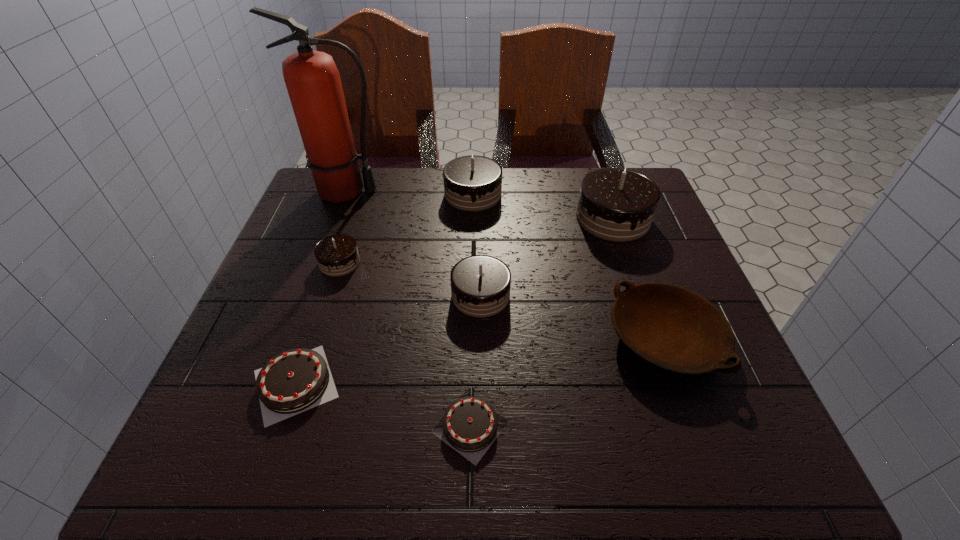
Find the location of a particular element. The height and width of the screenshot is (540, 960). vacant area situated 0.380m on the left of the brown plate is located at coordinates (406, 339).

I want to click on free space located 0.060m on the front of the left brown chocolate cake, so click(268, 465).

Find the location of a particular element. free region located on the back of the smaller brown chocolate cake is located at coordinates (473, 260).

I want to click on fire extinguisher present at the far edge, so click(x=313, y=82).

You are a GUI agent. You are given a task and a screenshot of the screen. Output one action in this format:
    pyautogui.click(x=<x>, y=<y>)
    Task: Click on the fire extinguisher that is at the left edge
    The width and height of the screenshot is (960, 540).
    Given the screenshot: What is the action you would take?
    pyautogui.click(x=313, y=82)

The height and width of the screenshot is (540, 960). In order to click on chocolate cake present at the right edge in this screenshot , I will do `click(615, 204)`.

The height and width of the screenshot is (540, 960). Identify the location of plate at the right edge. (674, 329).

Locate an element on the screen. object that is at the far left corner is located at coordinates (313, 82).

This screenshot has height=540, width=960. Find the location of `object that is at the near left corner`. object that is at the near left corner is located at coordinates (296, 380).

At what (x,y) coordinates should I click in order to perform the action: click on object situated at the far right corner. Please return your answer as a coordinate pair (x, y). Looking at the image, I should click on (615, 204).